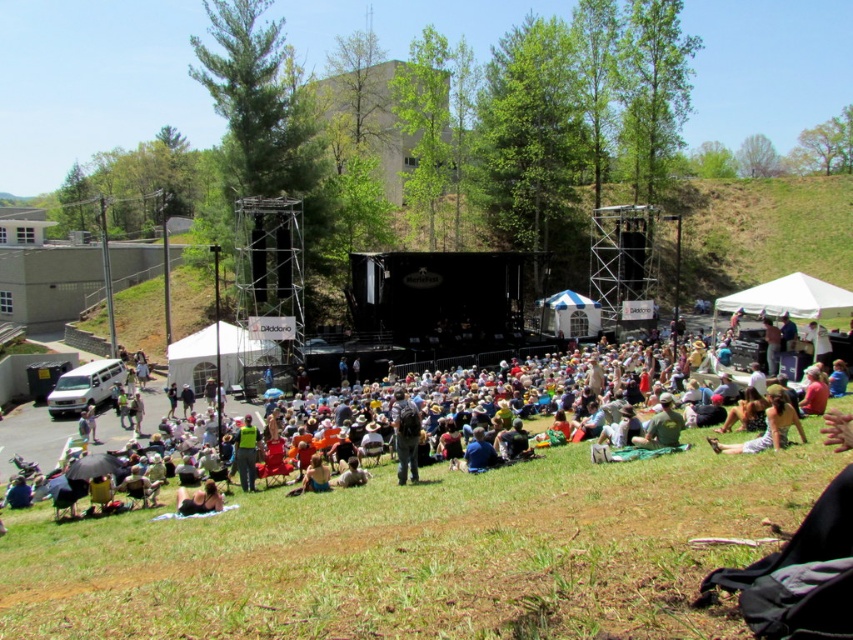
Is green fabric blanket at center to the right of blonde hair at lower center from the viewer's perspective?

Correct, you'll find green fabric blanket at center to the right of blonde hair at lower center.

Does green fabric blanket at center appear over blonde hair at lower center?

Correct, green fabric blanket at center is located above blonde hair at lower center.

Locate an element on the screen. The width and height of the screenshot is (853, 640). green fabric blanket at center is located at coordinates (660, 426).

Can you confirm if green fabric umbrella at center is taller than green fabric blanket at center?

Correct, green fabric umbrella at center is much taller as green fabric blanket at center.

Between point (607, 420) and point (660, 422), which one is positioned behind?

Point (607, 420)

Identify the location of green fabric umbrella at center. (502, 419).

This screenshot has height=640, width=853. I want to click on green fabric umbrella at center, so click(502, 419).

Is green fabric umbrella at center smaller than blonde hair at lower center?

No.

In the scene shown: Between green fabric umbrella at center and blonde hair at lower center, which one has more height?

green fabric umbrella at center

Find the location of a particular element. green fabric umbrella at center is located at coordinates (502, 419).

The height and width of the screenshot is (640, 853). In order to click on green fabric umbrella at center in this screenshot , I will do `click(502, 419)`.